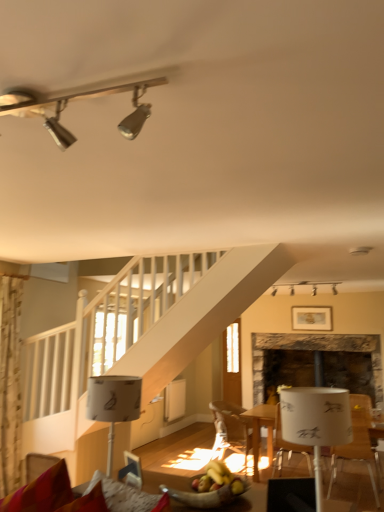
Locate an element on the screen. This screenshot has width=384, height=512. free location above metallic track lighting at upper left, which ranks as the third lamp in back-to-front order (from a real-world perspective) is located at coordinates (86, 84).